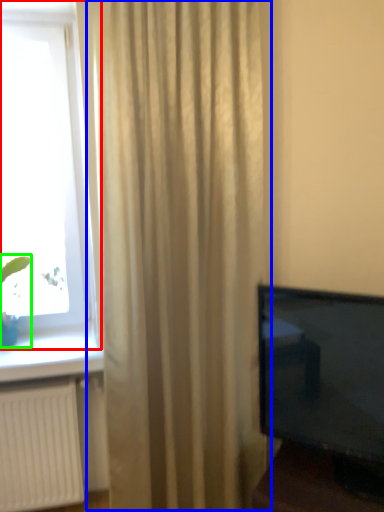
Question: Which object is the farthest from window (highlighted by a red box)? Choose among these: curtain (highlighted by a blue box) or plant (highlighted by a green box).

Choices:
 (A) curtain
 (B) plant

Answer: (B)